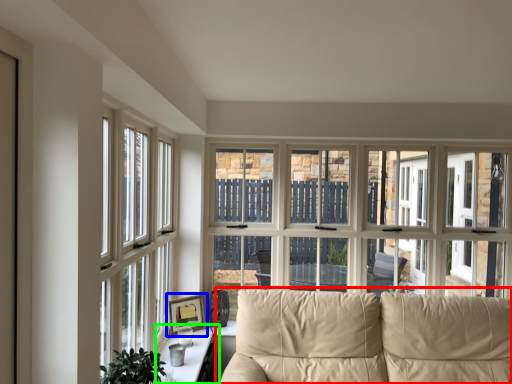
Question: Based on their relative distances, which object is farther from studio couch (highlighted by a red box)? Choose from picture frame (highlighted by a blue box) and table (highlighted by a green box).

Choices:
 (A) picture frame
 (B) table

Answer: (A)